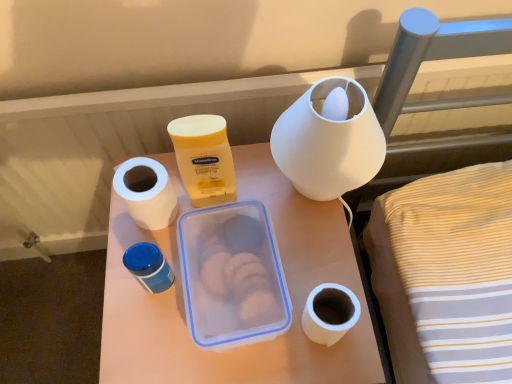
Locate an element on the screen. free point behind blue plastic container at center-left, the second pottery viewed from the top is located at coordinates point(195,215).